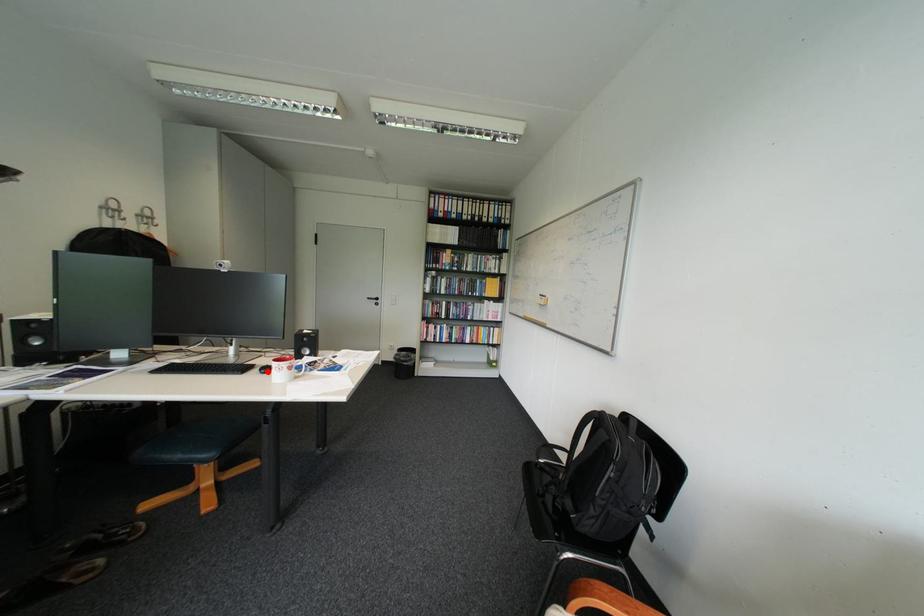
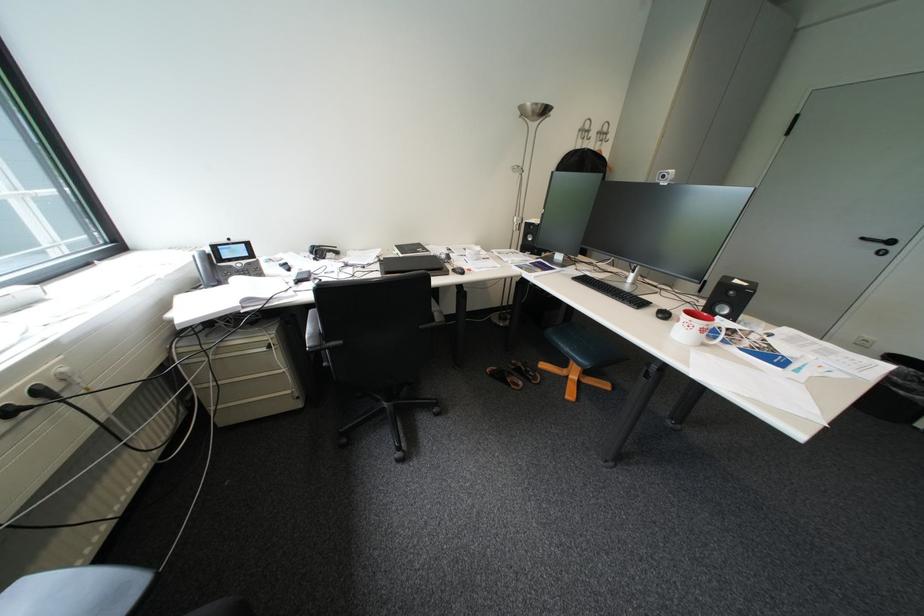
Where in the second image is the point corresponding to the highlighted location from the first image?

(663, 310)